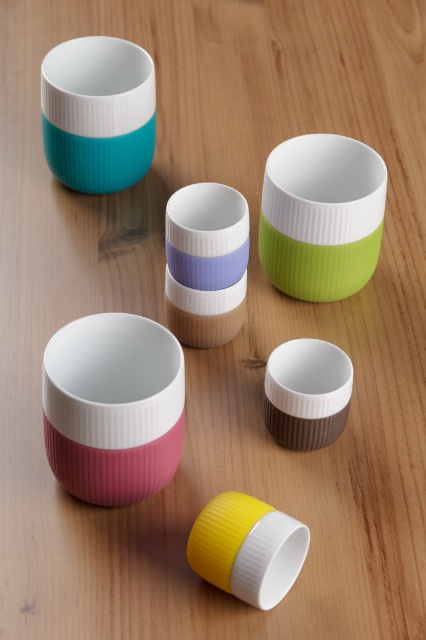
Does yellow matte cup at lower center have a smaller size compared to brown matte cup at center?

Indeed, yellow matte cup at lower center has a smaller size compared to brown matte cup at center.

Between point (261, 560) and point (287, 442), which one is positioned in front?

Point (261, 560) is more forward.

The height and width of the screenshot is (640, 426). Describe the element at coordinates (247, 548) in the screenshot. I see `yellow matte cup at lower center` at that location.

Locate an element on the screen. The height and width of the screenshot is (640, 426). yellow matte cup at lower center is located at coordinates (247, 548).

Does matte pink bowl at lower left appear over teal matte cup at upper left?

No, matte pink bowl at lower left is not above teal matte cup at upper left.

Which is in front, point (135, 355) or point (80, 44)?

Point (135, 355) is more forward.

This screenshot has width=426, height=640. What do you see at coordinates (112, 406) in the screenshot?
I see `matte pink bowl at lower left` at bounding box center [112, 406].

Identify the location of matte pink bowl at lower left. The image size is (426, 640). (112, 406).

Does green matte cup at center have a lesser height compared to teal matte cup at upper left?

No.

Between green matte cup at center and teal matte cup at upper left, which one has more height?

green matte cup at center

Is point (321, 216) behind point (146, 106)?

No, (321, 216) is closer to viewer.

Locate an element on the screen. The image size is (426, 640). green matte cup at center is located at coordinates (322, 216).